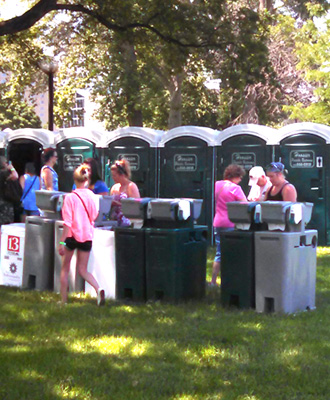
Where is `handwashing stations`? Image resolution: width=330 pixels, height=400 pixels. handwashing stations is located at coordinates (36, 248), (59, 235), (103, 246), (132, 253), (161, 261), (236, 256), (294, 258).